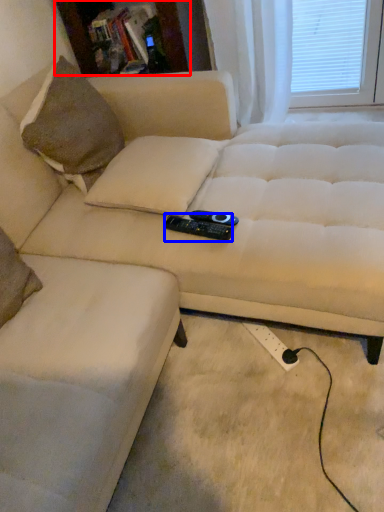
Question: Among these objects, which one is nearest to the camera, bookshelf (highlighted by a red box) or remote (highlighted by a blue box)?

Choices:
 (A) bookshelf
 (B) remote

Answer: (B)